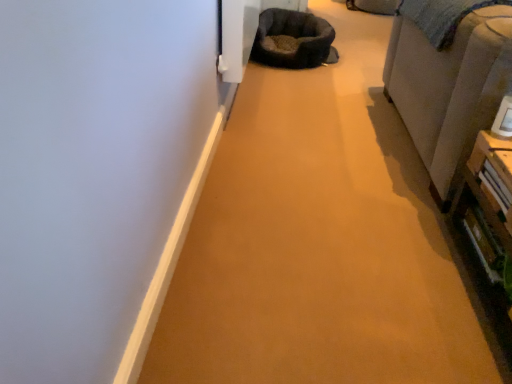
Question: From a real-world perspective, is dark brown plush bean bag chair at upper center positioned above or below beige fabric couch at right?

Choices:
 (A) below
 (B) above

Answer: (A)

Question: Looking at the image, does dark brown plush bean bag chair at upper center seem bigger or smaller compared to beige fabric couch at right?

Choices:
 (A) big
 (B) small

Answer: (B)

Question: Is point (329, 36) closer or farther from the camera than point (480, 104)?

Choices:
 (A) closer
 (B) farther

Answer: (B)

Question: From the image's perspective, is beige fabric couch at right located above or below dark brown plush bean bag chair at upper center?

Choices:
 (A) above
 (B) below

Answer: (B)

Question: From a real-world perspective, is beige fabric couch at right physically located above or below dark brown plush bean bag chair at upper center?

Choices:
 (A) above
 (B) below

Answer: (A)

Question: Relative to dark brown plush bean bag chair at upper center, is beige fabric couch at right in front or behind?

Choices:
 (A) behind
 (B) front

Answer: (B)

Question: Would you say beige fabric couch at right is to the left or to the right of dark brown plush bean bag chair at upper center in the picture?

Choices:
 (A) right
 (B) left

Answer: (A)